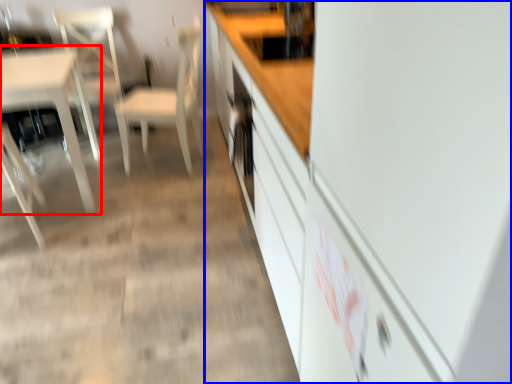
Question: Which object appears closest to the camera in this image, table (highlighted by a red box) or cabinetry (highlighted by a blue box)?

Choices:
 (A) table
 (B) cabinetry

Answer: (B)